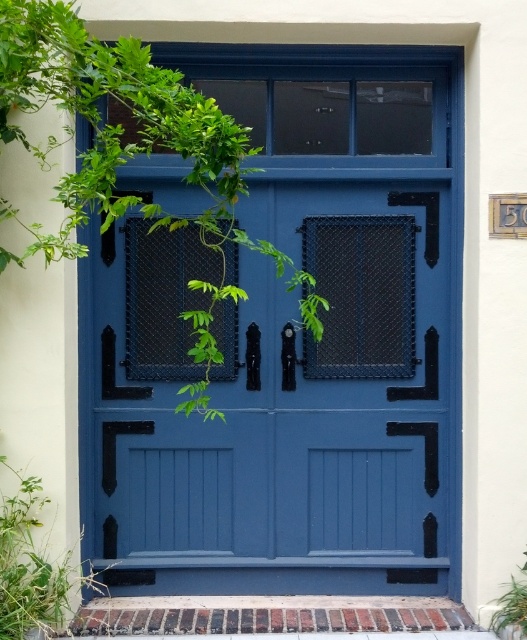
You are standing in front of the double doors and notice a green leafy plant. Which object is closer to you, the matte blue door at center or the green leafy plant at center?

The matte blue door at center is closer to you than the green leafy plant at center because it is positioned further away.

You are a painter who needs to decide which object to paint first between the matte blue door at center and the green leafy plant at center. Since you want to paint the taller object first, which one should you choose?

The matte blue door at center is much taller than the green leafy plant at center, so you should paint the matte blue door at center first.